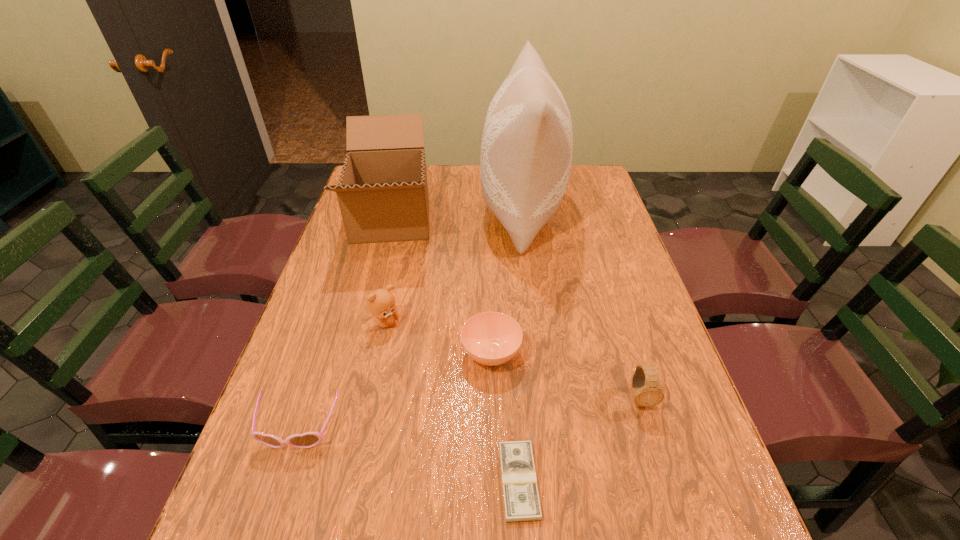
The image size is (960, 540). In order to click on free space between the tallest object and the box in this screenshot , I will do `click(456, 215)`.

Locate an element on the screen. This screenshot has height=540, width=960. free space between the sunglasses and the dollar is located at coordinates (409, 455).

Locate an element on the screen. vacant space in between the sunglasses and the teddy bear is located at coordinates (342, 375).

This screenshot has height=540, width=960. Find the location of `free point between the teddy bear and the sixth shortest object`. free point between the teddy bear and the sixth shortest object is located at coordinates (389, 271).

Identify the location of empty space between the sunglasses and the watch. (468, 413).

This screenshot has height=540, width=960. What are the coordinates of `object that is the fifth closest to the rightmost object` in the screenshot? It's located at (309, 439).

Select which object is the second closest to the teddy bear. Please provide its 2D coordinates. Your answer should be formatted as a tuple, i.e. [(x, y)], where the tuple contains the x and y coordinates of a point satisfying the conditions above.

[(382, 192)]

Image resolution: width=960 pixels, height=540 pixels. In order to click on free space in the image that satisfies the following two spatial constraints: 1. on the front side of the tallest object; 2. on the front-facing side of the sunglasses in this screenshot , I will do `click(548, 428)`.

At what (x,y) coordinates should I click in order to perform the action: click on free point that satisfies the following two spatial constraints: 1. on the face of the shortest object; 2. on the left side of the teddy bear. Please return your answer as a coordinate pair (x, y). Looking at the image, I should click on (351, 481).

This screenshot has height=540, width=960. What are the coordinates of `vacant region that satisfies the following two spatial constraints: 1. on the front-facing side of the dollar; 2. on the right side of the sunglasses` in the screenshot? It's located at (281, 481).